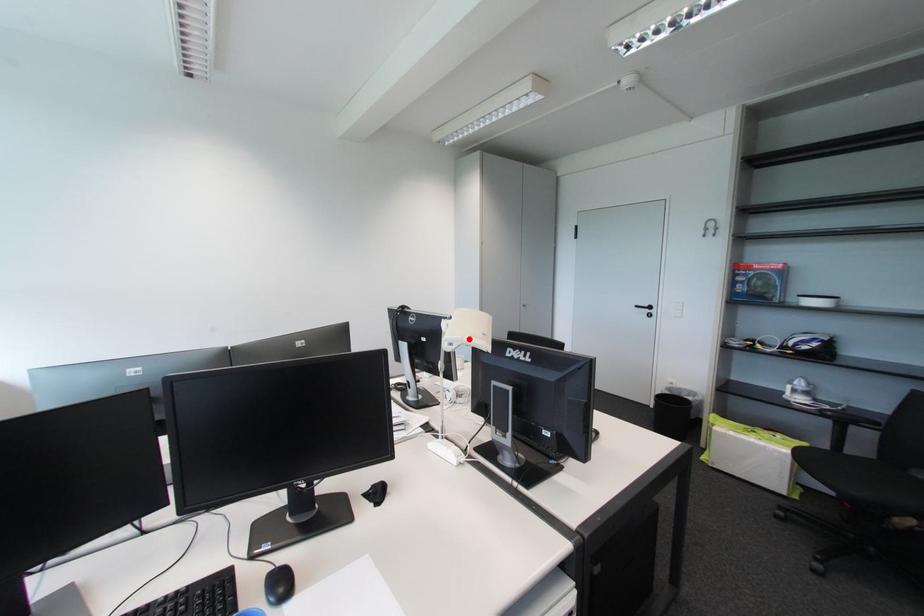
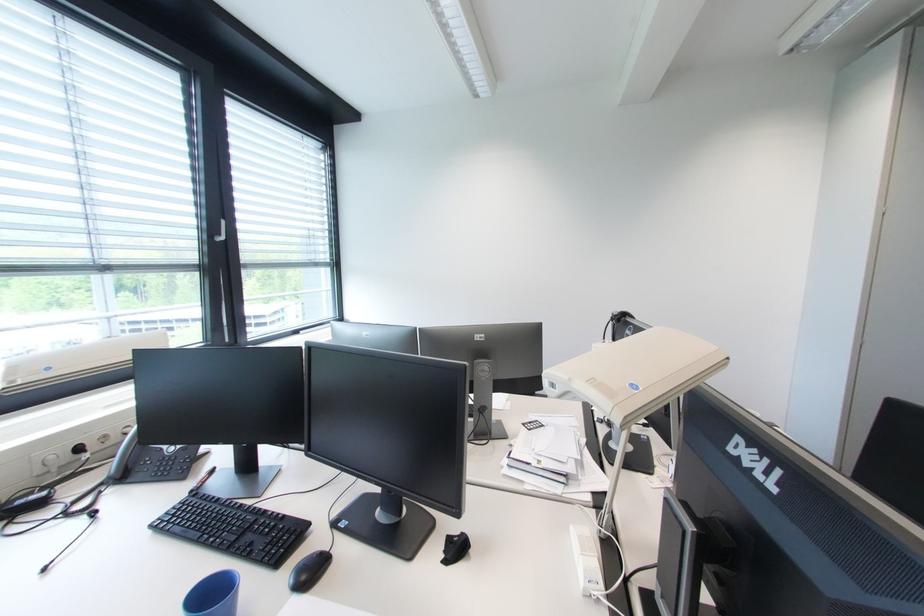
The point at the highlighted location is marked in the first image. Where is the corresponding point in the second image?

(577, 381)